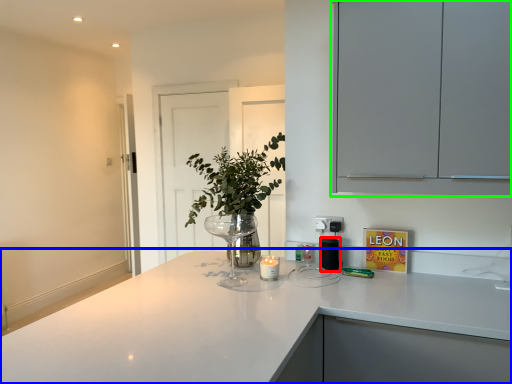
Question: Estimate the real-world distances between objects in this image. Which object is farther from appliance (highlighted by a red box), countertop (highlighted by a blue box) or cabinetry (highlighted by a green box)?

Choices:
 (A) countertop
 (B) cabinetry

Answer: (B)